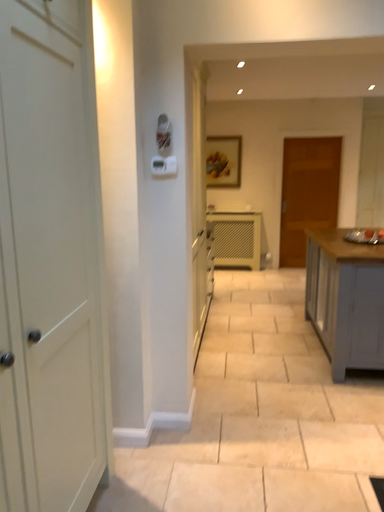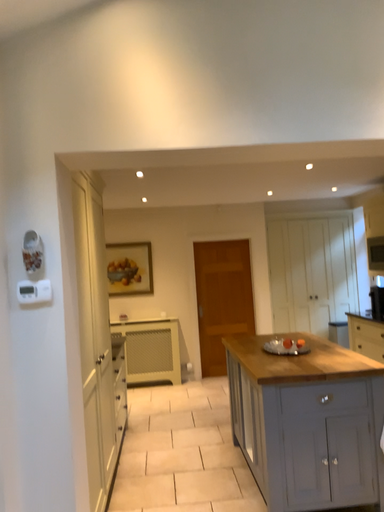
Question: Which way did the camera rotate in the video?

Choices:
 (A) rotated upward
 (B) rotated downward

Answer: (A)